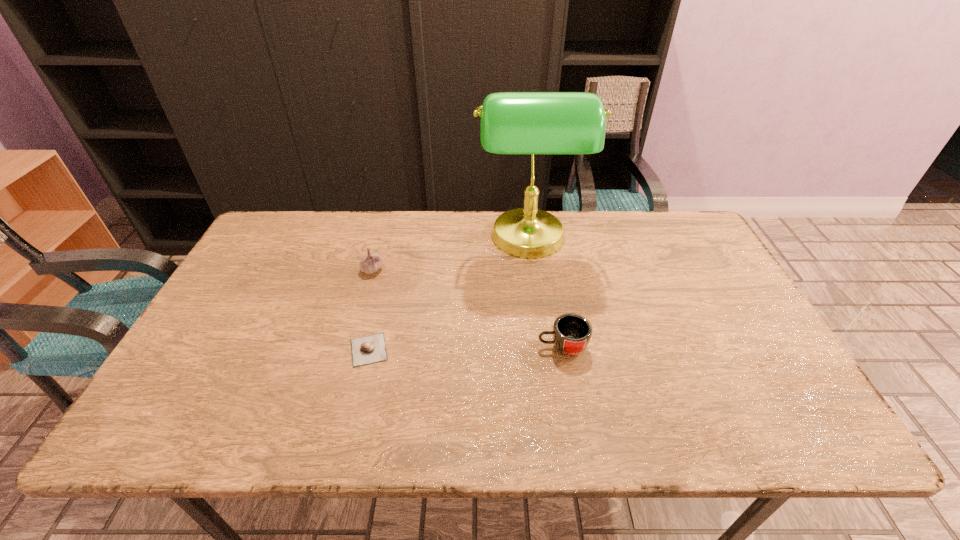
At what (x,y) coordinates should I click in order to perform the action: click on vacant region between the nearer garlic and the tallest object. Please return your answer as a coordinate pair (x, y). This screenshot has height=540, width=960. Looking at the image, I should click on (448, 295).

In order to click on free space between the lamp and the mug in this screenshot , I will do `click(545, 294)`.

Identify the location of empty space that is in between the lamp and the shorter garlic. (448, 295).

This screenshot has width=960, height=540. I want to click on free spot between the lamp and the mug, so click(x=545, y=294).

Locate an element on the screen. vacant area that lies between the tallest object and the mug is located at coordinates (545, 294).

This screenshot has width=960, height=540. What are the coordinates of `vacant area between the farther garlic and the mug` in the screenshot? It's located at (468, 308).

Identify the location of vacant space in between the shorter garlic and the mug. (466, 348).

Locate an element on the screen. free space between the tallest object and the mug is located at coordinates (545, 294).

Where is `empty location between the tallest object and the farther garlic`? The width and height of the screenshot is (960, 540). empty location between the tallest object and the farther garlic is located at coordinates (450, 255).

Identify the location of object that stands as the third closest to the mug. (371, 263).